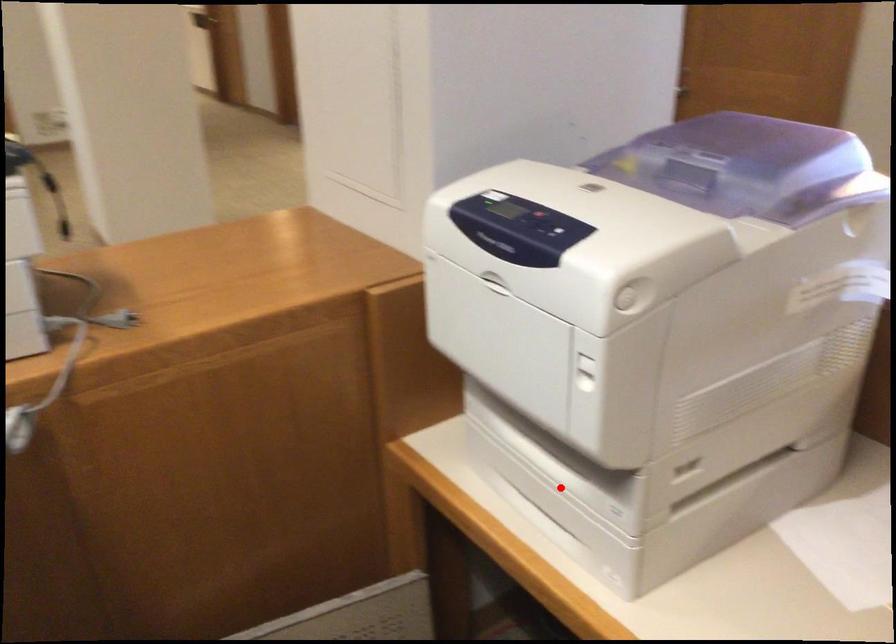
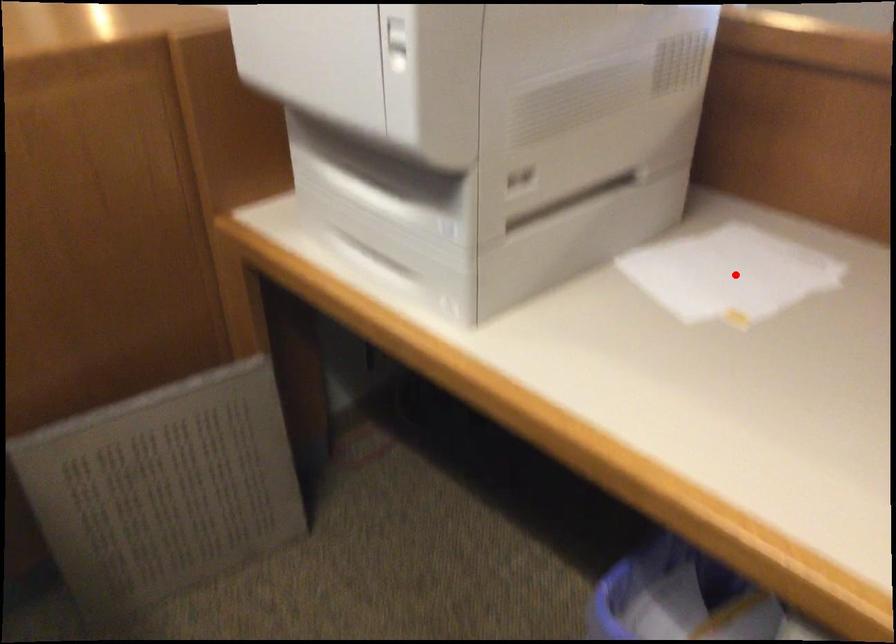
Consider the image. I am providing you with two images of the same scene from different viewpoints. A red point is marked on the first image and another point is marked on the second image. Are the points marked in image1 and image2 representing the same 3D position?

No